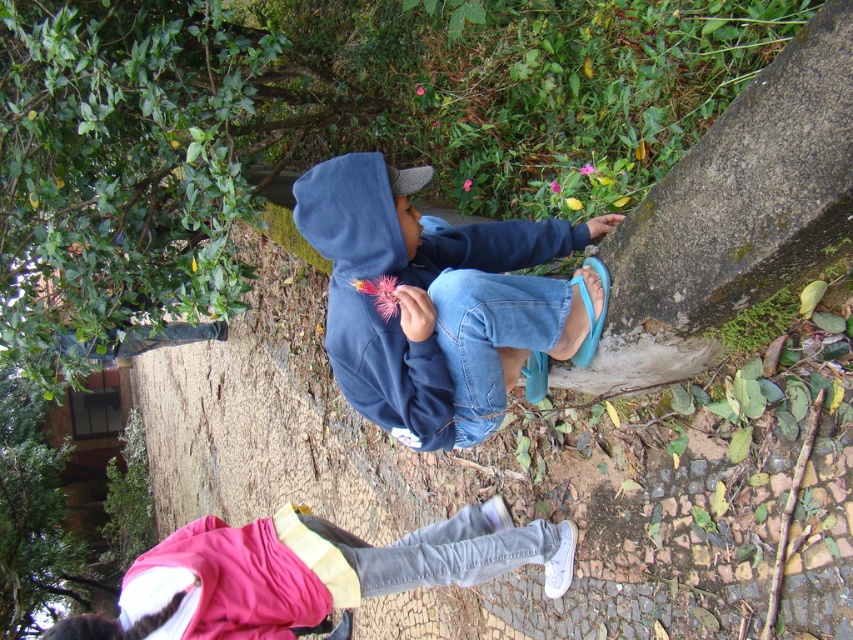
Question: Is navy blue hoodie at center further to camera compared to light blue denim jeans at lower center?

Choices:
 (A) no
 (B) yes

Answer: (A)

Question: Which object appears farthest from the camera in this image?

Choices:
 (A) light blue denim jeans at lower center
 (B) navy blue hoodie at center

Answer: (A)

Question: Is navy blue hoodie at center bigger than light blue denim jeans at lower center?

Choices:
 (A) yes
 (B) no

Answer: (B)

Question: Can you confirm if navy blue hoodie at center is thinner than light blue denim jeans at lower center?

Choices:
 (A) yes
 (B) no

Answer: (A)